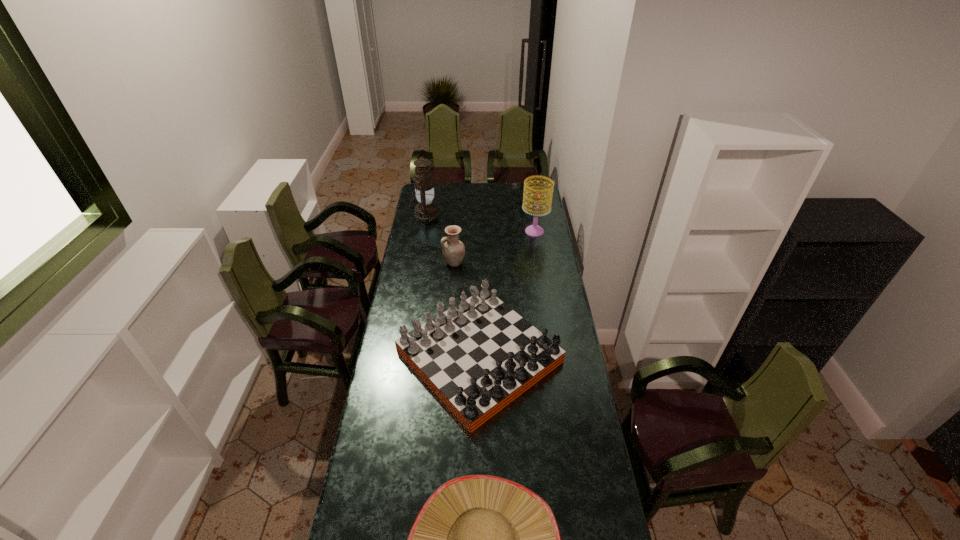
You are a GUI agent. You are given a task and a screenshot of the screen. Output one action in this format:
    pyautogui.click(x=<x>, y=<y>)
    Task: Click on the gameboard that is at the left edge
    
    Given the screenshot: What is the action you would take?
    pyautogui.click(x=478, y=356)

At what (x,y) coordinates should I click in order to perform the action: click on lampshade that is at the right edge. Please return your answer as a coordinate pair (x, y). The height and width of the screenshot is (540, 960). Looking at the image, I should click on (534, 230).

Identify the location of gameboard located in the right edge section of the desktop. (478, 356).

In the image, there is a desktop. Identify the location of vacant area at the far edge. (451, 194).

Find the location of `vacant area at the left edge of the desktop`. vacant area at the left edge of the desktop is located at coordinates (400, 379).

Where is `vacant region at the right edge of the desktop`? vacant region at the right edge of the desktop is located at coordinates (590, 429).

Where is `unoccupied area between the lampshade and the gameboard`? The height and width of the screenshot is (540, 960). unoccupied area between the lampshade and the gameboard is located at coordinates (507, 294).

Find the location of `free area in between the third shortest object and the lampshade`. free area in between the third shortest object and the lampshade is located at coordinates (494, 247).

You are a GUI agent. You are given a task and a screenshot of the screen. Output one action in this format:
    pyautogui.click(x=<x>, y=<y>)
    Task: Click on the free space between the lampshade and the oil lamp
    
    Given the screenshot: What is the action you would take?
    pyautogui.click(x=480, y=223)

This screenshot has width=960, height=540. I want to click on object that is the closest to the sunhat, so click(478, 356).